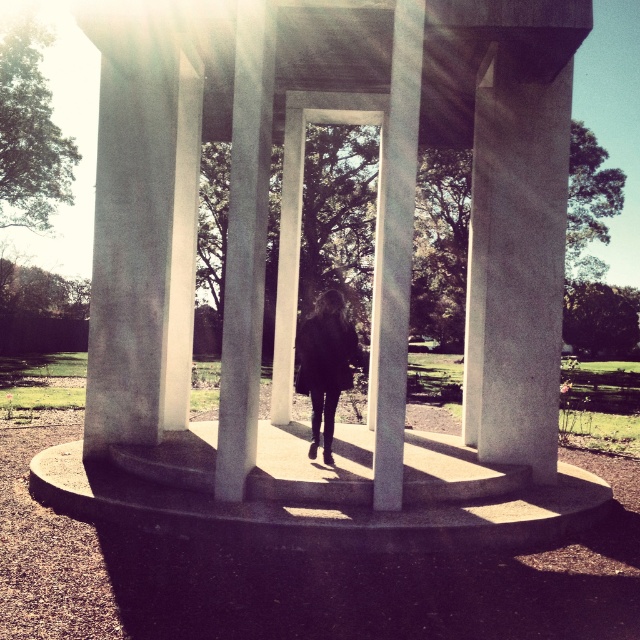
Question: Which point is closer to the camera?

Choices:
 (A) white concrete gazebo at center
 (B) dark matte coat at center

Answer: (A)

Question: From the image, what is the correct spatial relationship of smooth concrete pillar at center in relation to dark matte coat at center?

Choices:
 (A) left
 (B) right

Answer: (B)

Question: Can you confirm if white concrete gazebo at center is bigger than dark matte coat at center?

Choices:
 (A) no
 (B) yes

Answer: (B)

Question: Is white concrete gazebo at center to the left of smooth concrete pillar at center from the viewer's perspective?

Choices:
 (A) no
 (B) yes

Answer: (B)

Question: Which point is closer to the camera taking this photo?

Choices:
 (A) (529, 392)
 (B) (260, 140)

Answer: (B)

Question: Which of the following is the closest to the observer?

Choices:
 (A) smooth concrete pillar at center
 (B) white concrete gazebo at center

Answer: (B)